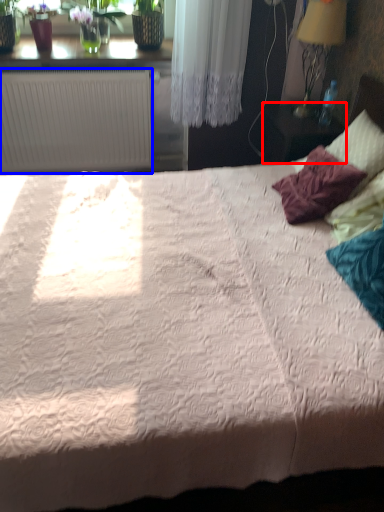
Question: Which point is further to the camera, table (highlighted by a red box) or radiator (highlighted by a blue box)?

Choices:
 (A) table
 (B) radiator

Answer: (B)